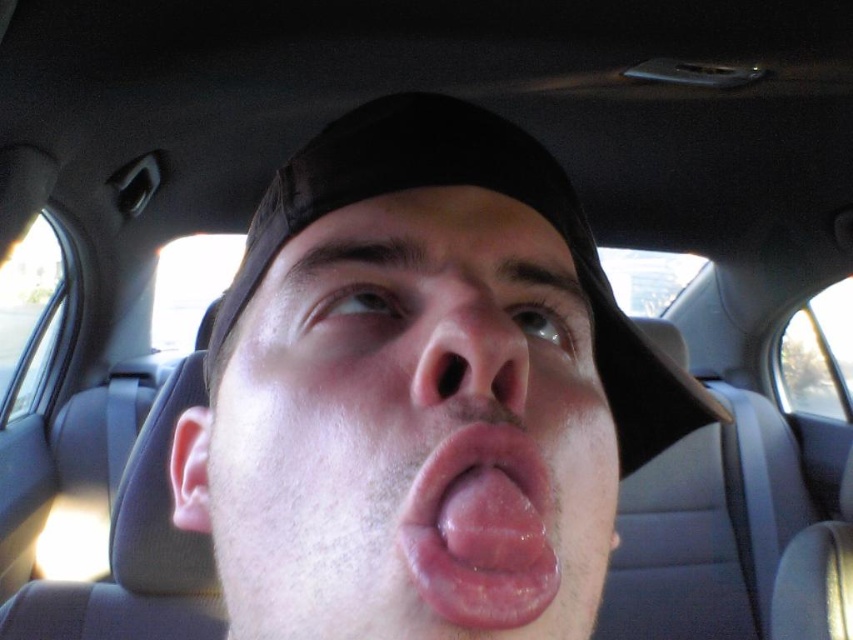
Between point (347, 362) and point (265, 266), which one is positioned behind?

Point (265, 266)

Who is shorter, smooth skin face at center or black fabric baseball hat at center?

With less height is smooth skin face at center.

Who is more distant from viewer, (305, 584) or (424, 156)?

The point (424, 156) is behind.

Locate an element on the screen. smooth skin face at center is located at coordinates (x=408, y=433).

Does pink smooth tongue at center appear on the right side of smooth skin nose at center?

Incorrect, pink smooth tongue at center is not on the right side of smooth skin nose at center.

Based on the photo, does pink smooth tongue at center appear under smooth skin nose at center?

Correct, pink smooth tongue at center is located below smooth skin nose at center.

The image size is (853, 640). In order to click on pink smooth tongue at center in this screenshot , I will do 480,529.

Image resolution: width=853 pixels, height=640 pixels. What do you see at coordinates (485, 188) in the screenshot? I see `black fabric baseball hat at center` at bounding box center [485, 188].

Between black fabric baseball hat at center and pink smooth tongue at center, which one is positioned higher?

black fabric baseball hat at center is above.

The height and width of the screenshot is (640, 853). Describe the element at coordinates (485, 188) in the screenshot. I see `black fabric baseball hat at center` at that location.

At what (x,y) coordinates should I click in order to perform the action: click on black fabric baseball hat at center. Please return your answer as a coordinate pair (x, y). The width and height of the screenshot is (853, 640). Looking at the image, I should click on (485, 188).